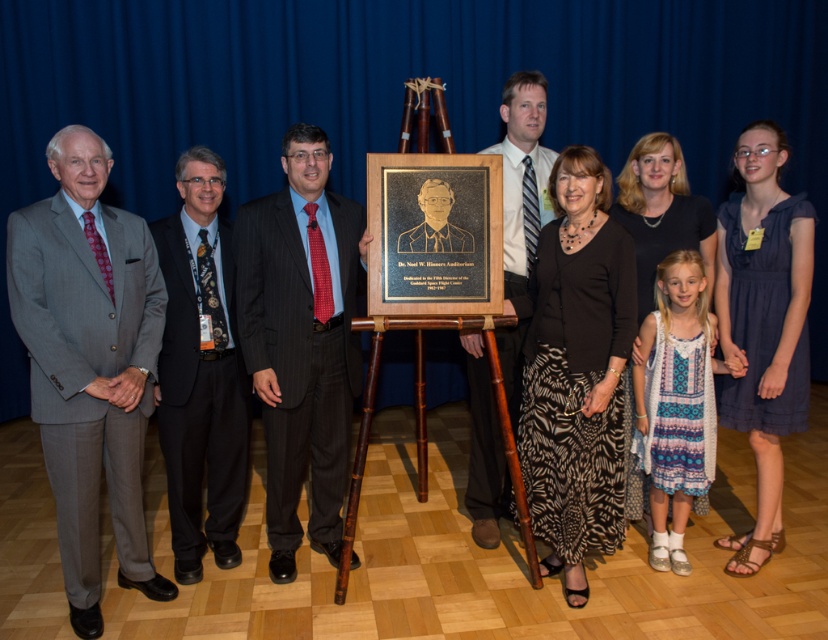
In the scene, there are two objects of interest. One is the plaque displayed on a wooden easel, and the other is the dark blue dress at lower right. Which of these two objects is positioned closer to the bottom edge of the image?

The dark blue dress at lower right is positioned closer to the bottom edge of the image because it is located at point 0.923 on the vertical axis, which is closer to the bottom compared to the plaque on the wooden easel.

You are a photographer at the event and need to adjust the lighting to ensure both the gray suit at left and the dark blue dress at lower right are visible. Which clothing item requires more light adjustment due to its size?

The gray suit at left requires more light adjustment because it is bigger than the dark blue dress at lower right.

You are a photographer trying to adjust the lighting for a group photo. You notice the dark blue dress at lower right and the matte black suit at center. Which of these two items is closer to the camera?

The dark blue dress at lower right is closer to the camera because it is in front of the matte black suit at center.